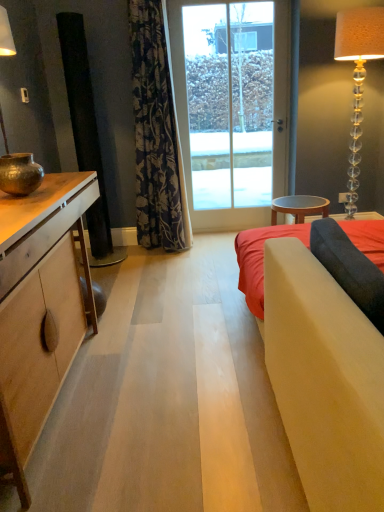
Identify the location of free space that is in between matte wood cabinet at left and dark floral fabric curtain at center. The height and width of the screenshot is (512, 384). (129, 315).